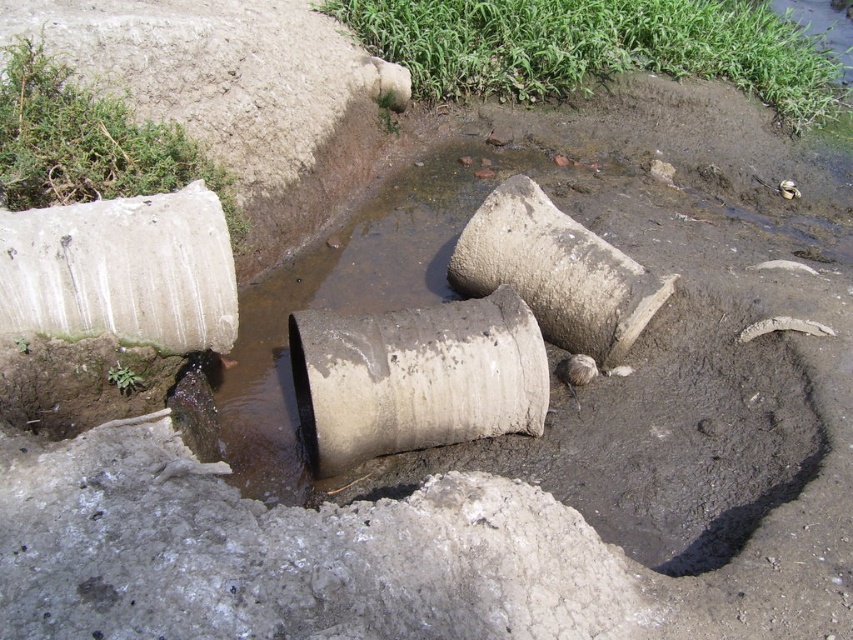
Question: Is muddy concrete pipe at center thinner than gray concrete water pipe at center?

Choices:
 (A) yes
 (B) no

Answer: (B)

Question: Is muddy concrete pipe at center closer to camera compared to gray concrete water pipe at center?

Choices:
 (A) no
 (B) yes

Answer: (B)

Question: Does muddy concrete pipe at center appear on the left side of gray concrete water pipe at center?

Choices:
 (A) no
 (B) yes

Answer: (B)

Question: Among these points, which one is farthest from the camera?

Choices:
 (A) (408, 308)
 (B) (621, 269)

Answer: (A)